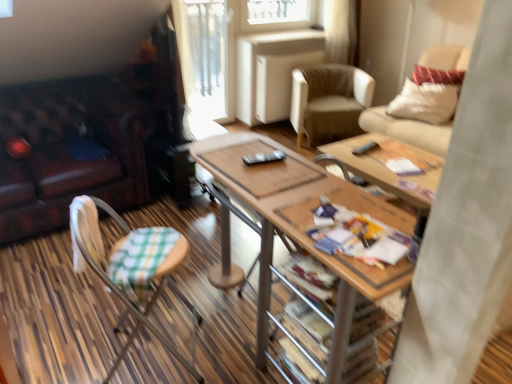
What do you see at coordinates (407, 130) in the screenshot?
I see `beige fabric chair at upper right, placed as the second chair when sorted from bottom to top` at bounding box center [407, 130].

What is the approximate height of white textured pillow at upper right?

It is 16.31 inches.

Describe the element at coordinates (425, 102) in the screenshot. The image size is (512, 384). I see `white textured pillow at upper right` at that location.

Where is `woodenmaterial/texturetable at center`? woodenmaterial/texturetable at center is located at coordinates (303, 231).

Describe the element at coordinates (204, 55) in the screenshot. This screenshot has height=384, width=512. I see `transparent glass door at upper center` at that location.

Measure the distance between point (362,154) and camera.

The distance of point (362,154) from camera is 2.61 meters.

Locate an element on the screen. The image size is (512, 384). green checkered fabric chair at lower left, the 1th chair positioned from the bottom is located at coordinates (114, 252).

Identify the location of beige fabric chair at upper right, the 2th chair in the top-to-bottom sequence. (407, 130).

I want to click on studio couch in front of the transparent glass door at upper center, so click(69, 151).

Between transparent glass door at upper center and leather couch at left, which one has less height?

leather couch at left.

Considering the sizes of transparent glass door at upper center and leather couch at left in the image, is transparent glass door at upper center bigger or smaller than leather couch at left?

transparent glass door at upper center is smaller than leather couch at left.

How many degrees apart are the facing directions of transparent glass door at upper center and leather couch at left?

0.61 degrees.

From a real-world perspective, is white textured pillow at upper right positioned over transparent glass door at upper center based on gravity?

Actually, white textured pillow at upper right is physically below transparent glass door at upper center in the real world.

Which object is closer to the camera taking this photo, white textured pillow at upper right or transparent glass door at upper center?

Positioned in front is white textured pillow at upper right.

This screenshot has height=384, width=512. Find the location of `remote control on the right of the beige leather armchair at center, arranged as the second chair when viewed from the right`. remote control on the right of the beige leather armchair at center, arranged as the second chair when viewed from the right is located at coordinates (365, 148).

In terms of size, does black plastic remote control at center, which appears as the first remote control when viewed from the right, appear bigger or smaller than beige leather armchair at center, acting as the third chair starting from the bottom?

black plastic remote control at center, which appears as the first remote control when viewed from the right, is smaller than beige leather armchair at center, acting as the third chair starting from the bottom.

What's the angular difference between black plastic remote control at center, which appears as the first remote control when viewed from the right, and beige leather armchair at center, the third chair in the front-to-back sequence,'s facing directions?

The facing directions of black plastic remote control at center, which appears as the first remote control when viewed from the right, and beige leather armchair at center, the third chair in the front-to-back sequence, are 50.6 degrees apart.

Between black plastic remote control at center, placed as the second remote control when sorted from left to right, and beige leather armchair at center, marked as the 1th chair in a top-to-bottom arrangement, which one appears on the left side from the viewer's perspective?

beige leather armchair at center, marked as the 1th chair in a top-to-bottom arrangement.

Is woodenmaterial/texturetable at center turned away from printed paper magazine at center?

No, woodenmaterial/texturetable at center is not facing the opposite direction of printed paper magazine at center.

Who is more distant, woodenmaterial/texturetable at center or printed paper magazine at center?

printed paper magazine at center.

From a real-world perspective, is woodenmaterial/texturetable at center above or below printed paper magazine at center?

From a real-world perspective, woodenmaterial/texturetable at center is physically below printed paper magazine at center.

Based on the photo, from the image's perspective, is woodenmaterial/texturetable at center located above or below printed paper magazine at center?

From the image's perspective, woodenmaterial/texturetable at center appears below printed paper magazine at center.

In the scene shown: Is black plastic remote control at center, placed as the 1th remote control when sorted from left to right, inside or outside of white textured pillow at upper right?

black plastic remote control at center, placed as the 1th remote control when sorted from left to right, is not inside white textured pillow at upper right, it's outside.

From the image's perspective, which object appears higher, black plastic remote control at center, the 2th remote control when ordered from back to front, or white textured pillow at upper right?

white textured pillow at upper right.

Which is nearer, (250,162) or (438,112)?

Point (250,162) is positioned closer to the camera compared to point (438,112).

From the image's perspective, is black plastic remote control at center, which ranks as the 2th remote control in bottom-to-top order, located beneath black plastic remote control at center, which is the second remote control in top-to-bottom order?

No, from the image's perspective, black plastic remote control at center, which ranks as the 2th remote control in bottom-to-top order, is not below black plastic remote control at center, which is the second remote control in top-to-bottom order.

Who is shorter, black plastic remote control at center, which ranks as the 2th remote control in bottom-to-top order, or black plastic remote control at center, which is the second remote control in top-to-bottom order?

black plastic remote control at center, which ranks as the 2th remote control in bottom-to-top order, is shorter.

In the scene shown: From a real-world perspective, which object stands above the other?

black plastic remote control at center, which is the 1th remote control in front-to-back order, is physically above.

Considering the positions of objects leather couch at left and beige fabric chair at upper right, the 2th chair in the top-to-bottom sequence, in the image provided, who is more to the left, leather couch at left or beige fabric chair at upper right, the 2th chair in the top-to-bottom sequence,?

Positioned to the left is leather couch at left.

Based on the photo, can you confirm if leather couch at left is bigger than beige fabric chair at upper right, the 2th chair in the top-to-bottom sequence?

Yes, leather couch at left is bigger than beige fabric chair at upper right, the 2th chair in the top-to-bottom sequence.

Is leather couch at left facing towards beige fabric chair at upper right, the 2th chair in the top-to-bottom sequence?

No, leather couch at left is not turned towards beige fabric chair at upper right, the 2th chair in the top-to-bottom sequence.

Is leather couch at left thinner than beige fabric chair at upper right, acting as the 2th chair starting from the front?

No, leather couch at left is not thinner than beige fabric chair at upper right, acting as the 2th chair starting from the front.

Find the location of a particular element. glass door above the leather couch at left (from a real-world perspective) is located at coordinates (204, 55).

The width and height of the screenshot is (512, 384). In order to click on pillow that is below the transparent glass door at upper center (from the image's perspective) in this screenshot , I will do `click(425, 102)`.

When comparing their distances from printed paper magazine at center, does transparent glass door at upper center or woodenmaterial/texturetable at center seem further?

Based on the image, transparent glass door at upper center appears to be further to printed paper magazine at center.

Looking at the image, which one is located closer to beige leather armchair at center, placed as the first chair when sorted from back to front, black plastic remote control at center, placed as the 1th remote control when sorted from left to right, or woodenmaterial/texturetable at center?

woodenmaterial/texturetable at center is closer to beige leather armchair at center, placed as the first chair when sorted from back to front.

Looking at the image, which one is located closer to black plastic remote control at center, placed as the second remote control when sorted from left to right, beige leather armchair at center, acting as the third chair starting from the bottom, or leather couch at left?

Among the two, beige leather armchair at center, acting as the third chair starting from the bottom, is located nearer to black plastic remote control at center, placed as the second remote control when sorted from left to right.

Estimate the real-world distances between objects in this image. Which object is further from transparent glass door at upper center, white textured pillow at upper right or beige leather armchair at center, arranged as the second chair when viewed from the right?

white textured pillow at upper right lies further to transparent glass door at upper center than the other object.

Estimate the real-world distances between objects in this image. Which object is closer to beige fabric chair at upper right, the 2th chair when ordered from back to front, white textured pillow at upper right or green checkered fabric chair at lower left, positioned as the 1th chair in left-to-right order?

white textured pillow at upper right is closer to beige fabric chair at upper right, the 2th chair when ordered from back to front.

From the image, which object appears to be farther from beige fabric chair at upper right, placed as the second chair when sorted from bottom to top, leather couch at left or white textured pillow at upper right?

The object further to beige fabric chair at upper right, placed as the second chair when sorted from bottom to top, is leather couch at left.

Consider the image. Looking at the image, which one is located further to woodenmaterial/texturetable at center, beige leather armchair at center, which is counted as the second chair, starting from the left, or beige fabric chair at upper right, which appears as the first chair when viewed from the right?

beige leather armchair at center, which is counted as the second chair, starting from the left, lies further to woodenmaterial/texturetable at center than the other object.

Estimate the real-world distances between objects in this image. Which object is closer to black plastic remote control at center, which appears as the 1th remote control when viewed from the back, transparent glass door at upper center or woodenmaterial/texturetable at center?

Among the two, woodenmaterial/texturetable at center is located nearer to black plastic remote control at center, which appears as the 1th remote control when viewed from the back.

Locate an element on the screen. remote control between printed paper magazine at center and black plastic remote control at center, which ranks as the 2th remote control in bottom-to-top order, in the front-back direction is located at coordinates (263, 158).

Where is `chair positioned between woodenmaterial/texturetable at center and black plastic remote control at center, the second remote control positioned from the right, from near to far`? chair positioned between woodenmaterial/texturetable at center and black plastic remote control at center, the second remote control positioned from the right, from near to far is located at coordinates (114, 252).

Locate an element on the screen. Image resolution: width=512 pixels, height=384 pixels. magazine positioned between woodenmaterial/texturetable at center and beige fabric chair at upper right, which is the third chair in left-to-right order, from near to far is located at coordinates (360, 235).

You are a GUI agent. You are given a task and a screenshot of the screen. Output one action in this format:
    pyautogui.click(x=<x>, y=<y>)
    Task: Click on the chair situated between leather couch at left and woodenmaterial/texturetable at center from left to right
    
    Given the screenshot: What is the action you would take?
    pyautogui.click(x=114, y=252)